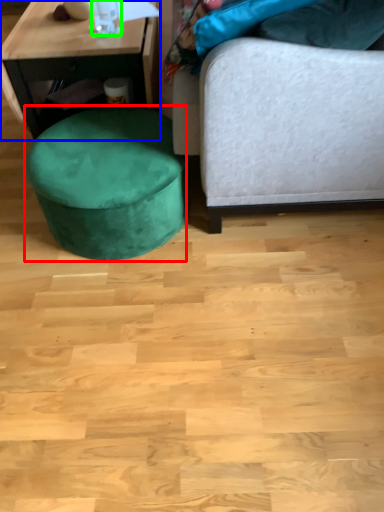
Question: Which is farther away from music stool (highlighted by a red box)? table (highlighted by a blue box) or bottle (highlighted by a green box)?

Choices:
 (A) table
 (B) bottle

Answer: (B)